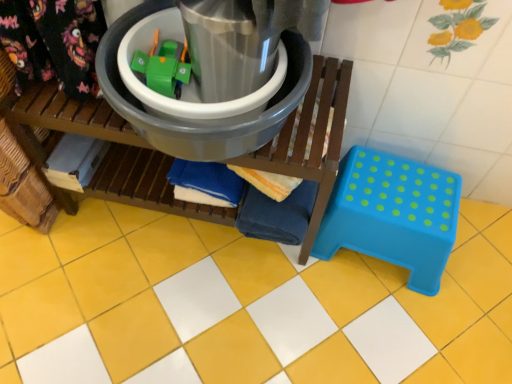
Question: Does yellow glossy tile at center have a lesser height compared to matte plastic bucket at center?

Choices:
 (A) yes
 (B) no

Answer: (A)

Question: Is matte plastic bucket at center at the back of yellow glossy tile at center?

Choices:
 (A) yes
 (B) no

Answer: (B)

Question: From a real-world perspective, is yellow glossy tile at center physically above matte plastic bucket at center?

Choices:
 (A) yes
 (B) no

Answer: (B)

Question: Is yellow glossy tile at center next to matte plastic bucket at center?

Choices:
 (A) no
 (B) yes

Answer: (A)

Question: Can you confirm if yellow glossy tile at center is positioned to the left of matte plastic bucket at center?

Choices:
 (A) no
 (B) yes

Answer: (A)

Question: Is yellow glossy tile at center facing towards matte plastic bucket at center?

Choices:
 (A) yes
 (B) no

Answer: (B)

Question: Is yellow glossy tile at center facing away from metallic plastic bucket at center?

Choices:
 (A) no
 (B) yes

Answer: (A)

Question: Can you confirm if yellow glossy tile at center is shorter than metallic plastic bucket at center?

Choices:
 (A) no
 (B) yes

Answer: (B)

Question: Are yellow glossy tile at center and metallic plastic bucket at center located far from each other?

Choices:
 (A) yes
 (B) no

Answer: (B)

Question: From the image's perspective, is yellow glossy tile at center over metallic plastic bucket at center?

Choices:
 (A) yes
 (B) no

Answer: (B)

Question: Is metallic plastic bucket at center surrounded by yellow glossy tile at center?

Choices:
 (A) no
 (B) yes

Answer: (A)

Question: Is yellow glossy tile at center closer to camera compared to metallic plastic bucket at center?

Choices:
 (A) yes
 (B) no

Answer: (B)

Question: Is the depth of metallic plastic bucket at center less than that of blue plastic step stool at lower right?

Choices:
 (A) yes
 (B) no

Answer: (A)